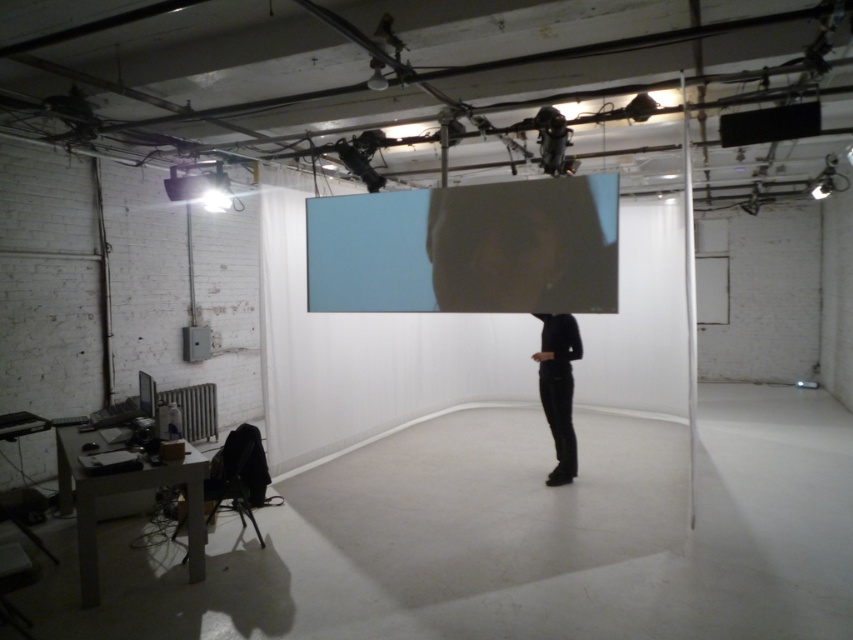
Does matte blue screen at center appear over black matte pants at center?

Yes.

Is matte blue screen at center taller than black matte pants at center?

No.

Measure the distance between matte blue screen at center and camera.

matte blue screen at center is 4.28 meters from camera.

Where is `matte blue screen at center`? matte blue screen at center is located at coordinates (466, 248).